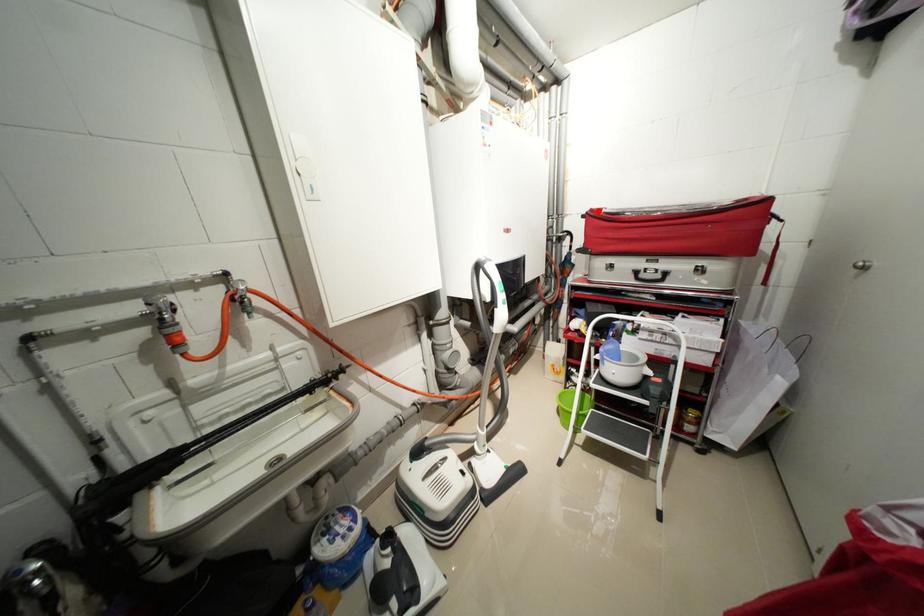
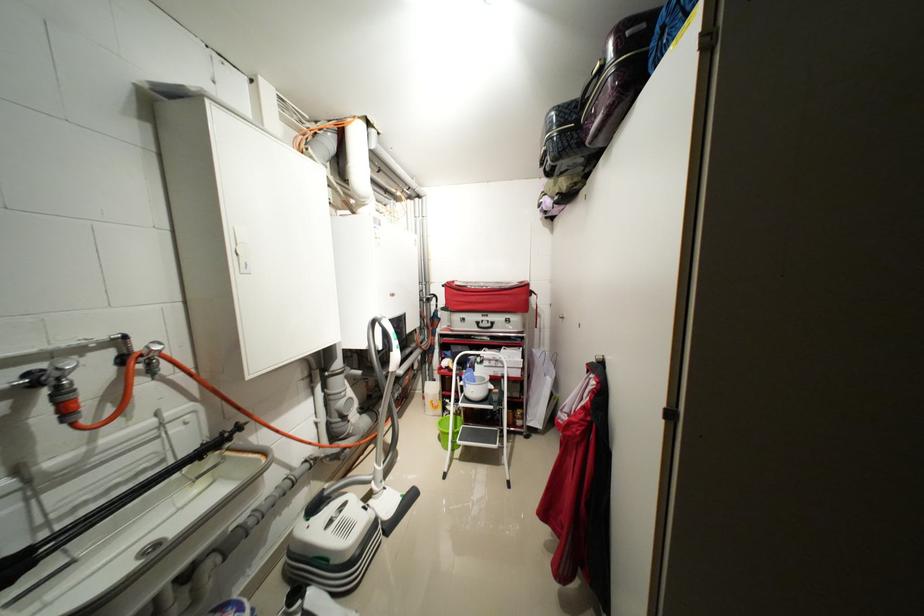
Find the pixel in the second image that matches the highlighted location in the first image.

(455, 284)